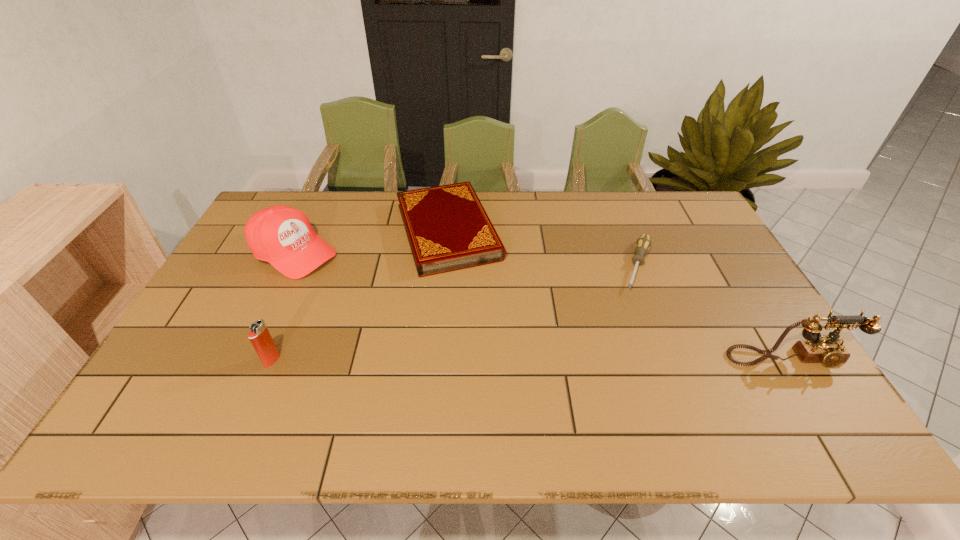
Identify the location of blank space at the far right corner of the desktop. (668, 194).

Locate an element on the screen. The image size is (960, 540). free space between the igniter and the rightmost object is located at coordinates (532, 359).

Image resolution: width=960 pixels, height=540 pixels. I want to click on vacant area that lies between the igniter and the rightmost object, so click(532, 359).

Locate an element on the screen. Image resolution: width=960 pixels, height=540 pixels. free spot between the telephone and the shortest object is located at coordinates (714, 312).

At what (x,y) coordinates should I click in order to perform the action: click on empty space that is in between the hardback book and the igniter. Please return your answer as a coordinate pair (x, y). Looking at the image, I should click on (360, 296).

Identify the location of vacant area between the fourth object from left to right and the third object from right to left. The image size is (960, 540). (542, 248).

Where is `free space between the igniter and the hardback book`? The width and height of the screenshot is (960, 540). free space between the igniter and the hardback book is located at coordinates (360, 296).

Image resolution: width=960 pixels, height=540 pixels. In order to click on unoccupied position between the third object from left to right and the rightmost object in this screenshot , I will do `click(619, 295)`.

The width and height of the screenshot is (960, 540). What are the coordinates of `free space between the igniter and the rightmost object` in the screenshot? It's located at (532, 359).

The width and height of the screenshot is (960, 540). What are the coordinates of `empty space between the third object from left to right and the igniter` in the screenshot? It's located at (360, 296).